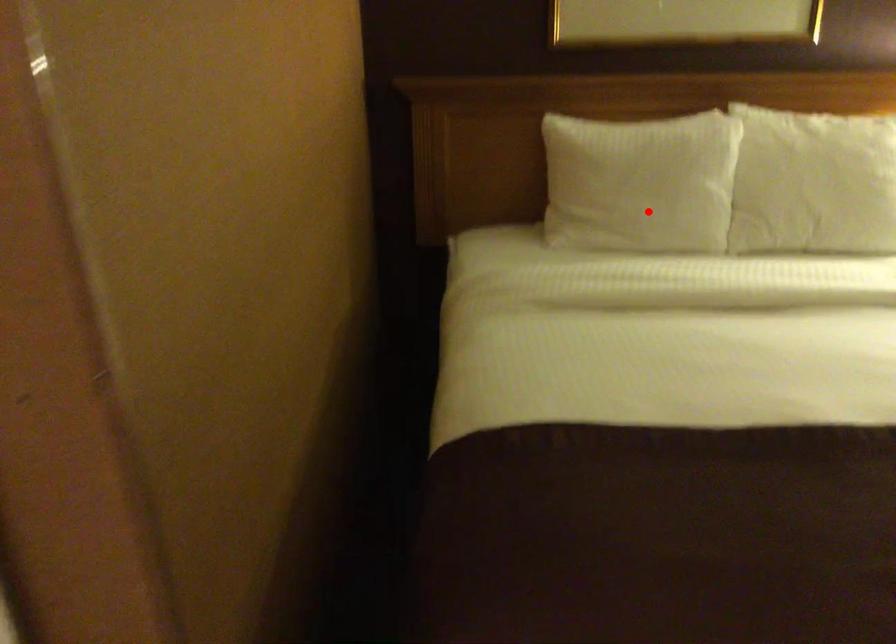
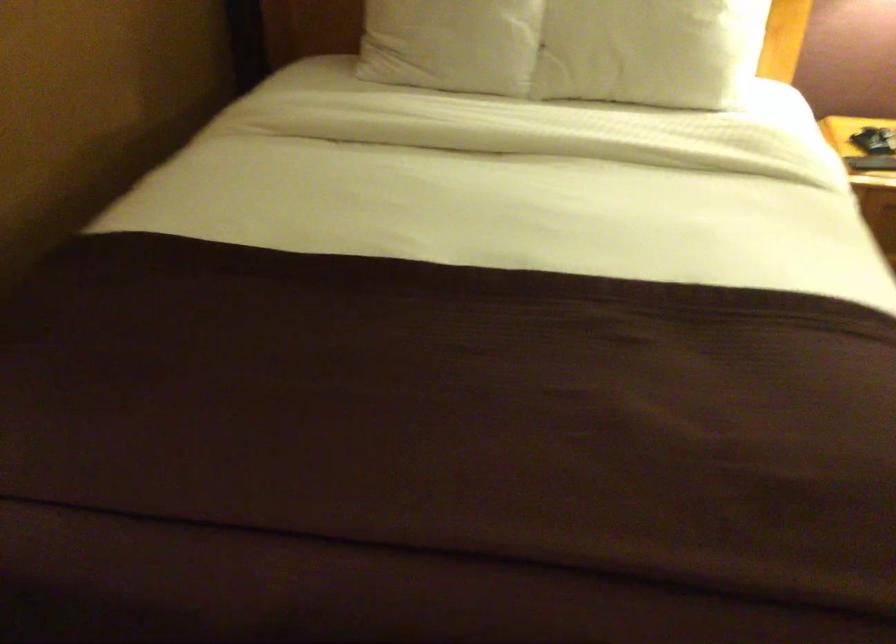
In the second image, find the point that corresponds to the highlighted location in the first image.

(452, 44)